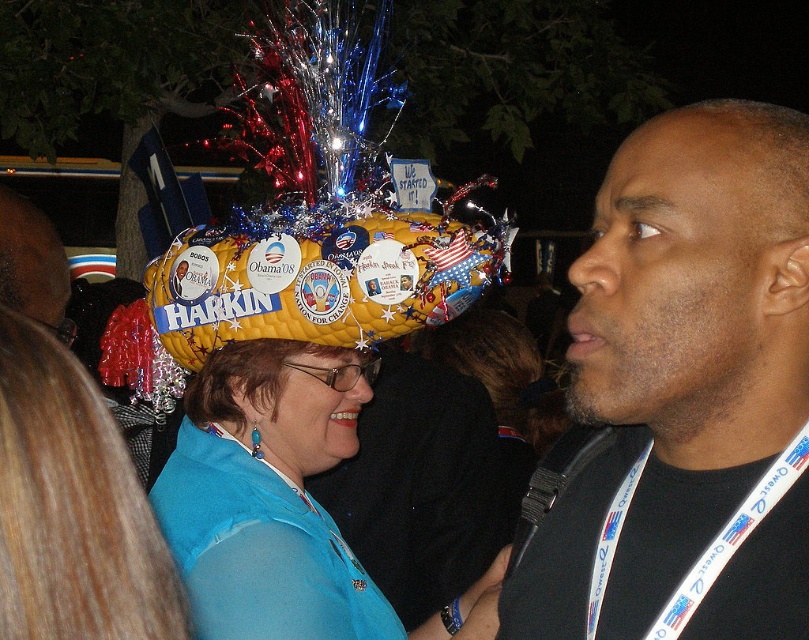
From the picture: Is the position of matte yellow hat at center more distant than that of yellow quilted hat at center?

No, it is in front of yellow quilted hat at center.

Between matte yellow hat at center and yellow quilted hat at center, which one is positioned lower?

Positioned lower is matte yellow hat at center.

Is point (333, 461) positioned behind point (157, 292)?

Yes.

Locate an element on the screen. matte yellow hat at center is located at coordinates (269, 496).

Who is more forward, (619, 451) or (172, 284)?

Point (619, 451) is more forward.

Which is behind, point (699, 515) or point (276, 244)?

Point (276, 244)

Measure the distance between black lanyard at right and camera.

black lanyard at right is 3.84 feet away from camera.

Where is `black lanyard at right`? The width and height of the screenshot is (809, 640). black lanyard at right is located at coordinates (683, 396).

Is point (583, 339) positioned after point (695, 572)?

Yes.

Describe the element at coordinates (697, 280) in the screenshot. I see `bald head at center` at that location.

The width and height of the screenshot is (809, 640). I want to click on bald head at center, so click(x=697, y=280).